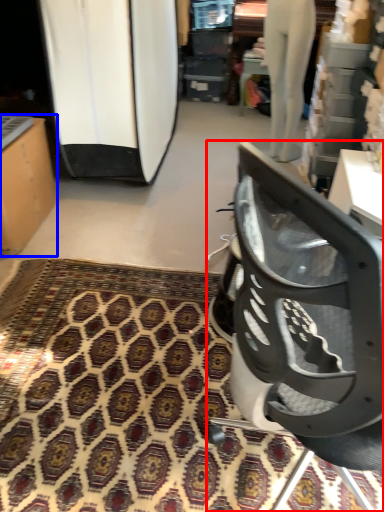
Question: Which of the following is the farthest to the observer, chair (highlighted by a red box) or furniture (highlighted by a blue box)?

Choices:
 (A) chair
 (B) furniture

Answer: (B)